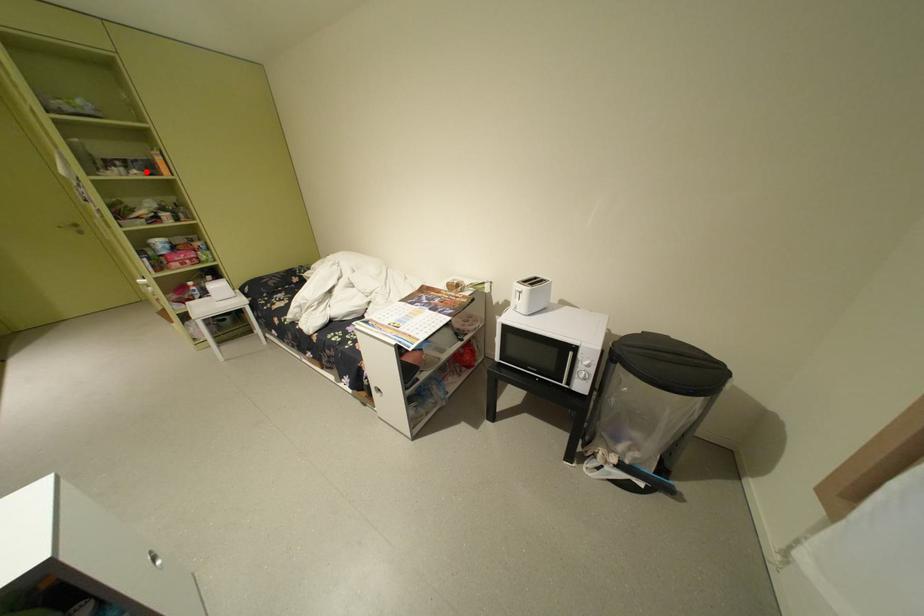
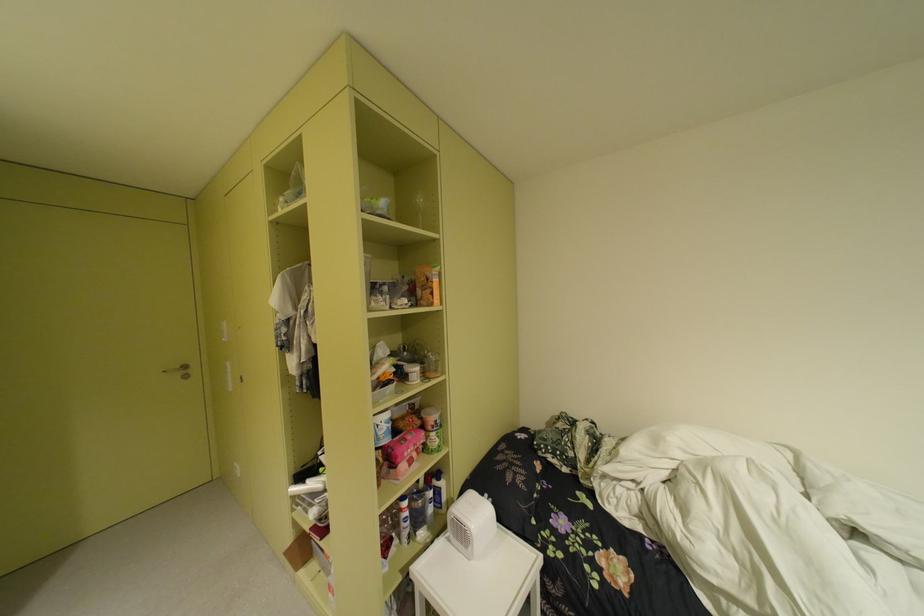
The point at the highlighted location is marked in the first image. Where is the corresponding point in the second image?

(417, 301)